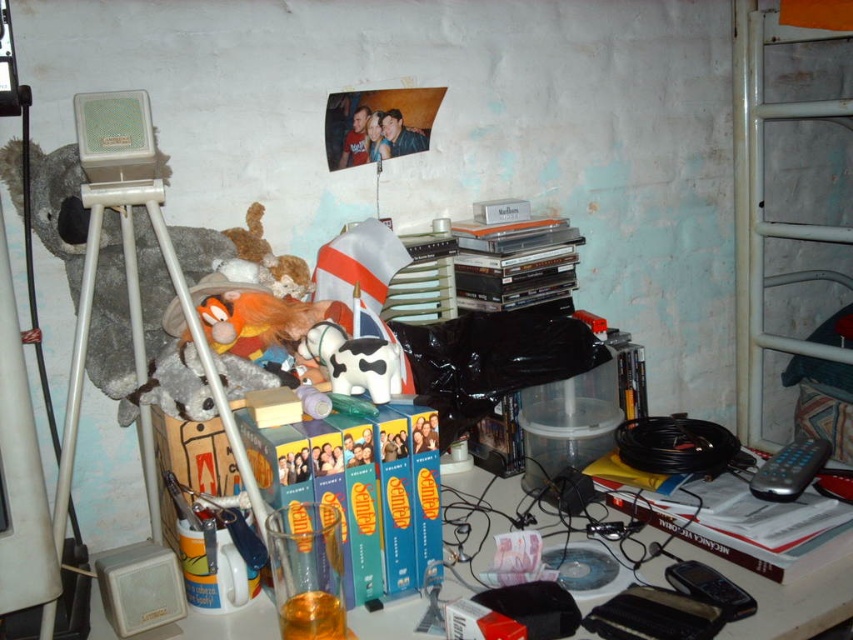
You are trying to place the black plastic remote control at lower right on the transparent plastic table at center. Will it fit on top of the table?

The transparent plastic table at center has a greater height compared to black plastic remote control at lower right, so yes, the remote control can be placed on top of the table since the table is taller than the remote control.